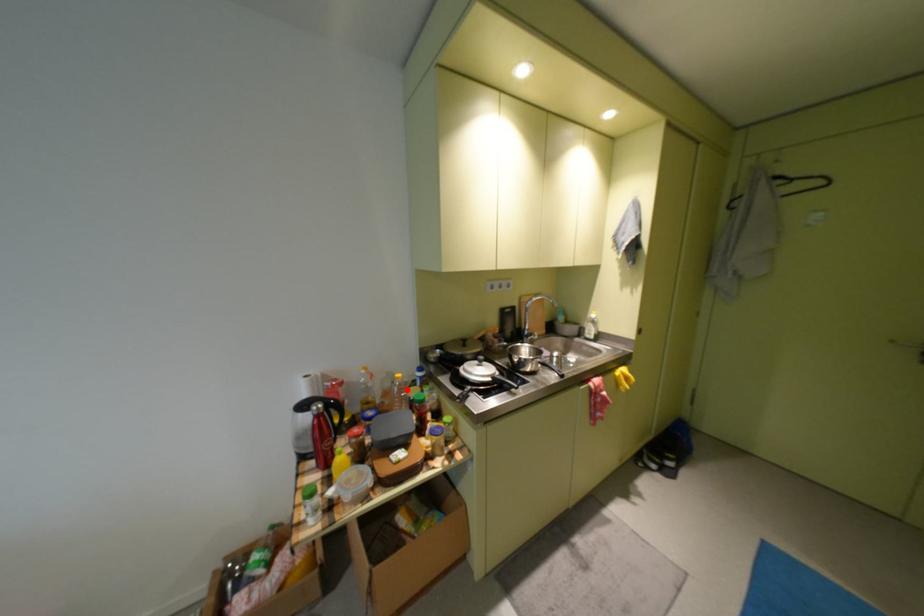
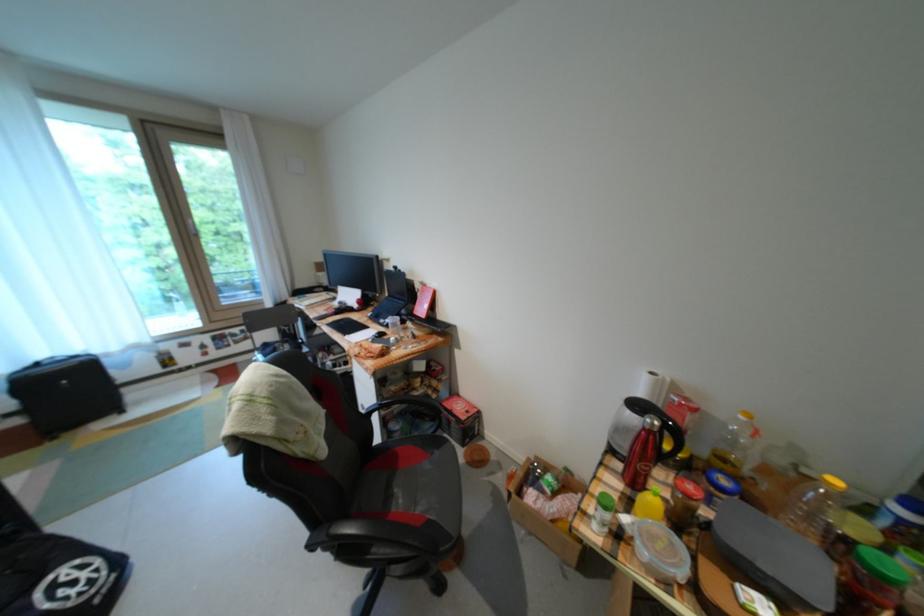
Find the pixel in the second image that matches the highlighted location in the first image.

(821, 495)